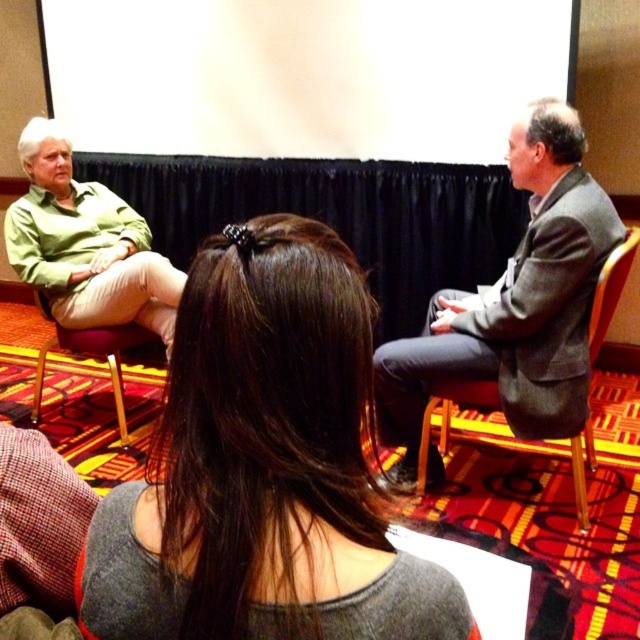
The image size is (640, 640). What do you see at coordinates (515, 301) in the screenshot?
I see `gray suit at right` at bounding box center [515, 301].

Is gray suit at right positioned behind green matte shirt at left?

No, gray suit at right is closer to the viewer.

Describe the element at coordinates (515, 301) in the screenshot. Image resolution: width=640 pixels, height=640 pixels. I see `gray suit at right` at that location.

Find the location of a particular element. gray suit at right is located at coordinates (515, 301).

Does dark brown hair at center have a lesser width compared to white matte projection screen at upper center?

Indeed, dark brown hair at center has a lesser width compared to white matte projection screen at upper center.

Who is more forward, [336,536] or [381,145]?

Point [336,536] is in front.

What do you see at coordinates (262, 467) in the screenshot? The width and height of the screenshot is (640, 640). I see `dark brown hair at center` at bounding box center [262, 467].

You are a GUI agent. You are given a task and a screenshot of the screen. Output one action in this format:
    pyautogui.click(x=<x>, y=<y>)
    Task: Click on the dark brown hair at center
    
    Given the screenshot: What is the action you would take?
    pyautogui.click(x=262, y=467)

Looking at this image, is white matte projection screen at upper center positioned before gray suit at right?

No, it is not.

Between white matte projection screen at upper center and gray suit at right, which one has less height?

white matte projection screen at upper center is shorter.

Is point (467, 72) closer to viewer compared to point (522, 147)?

No, it is not.

Identify the location of white matte projection screen at upper center. This screenshot has width=640, height=640. [301, 74].